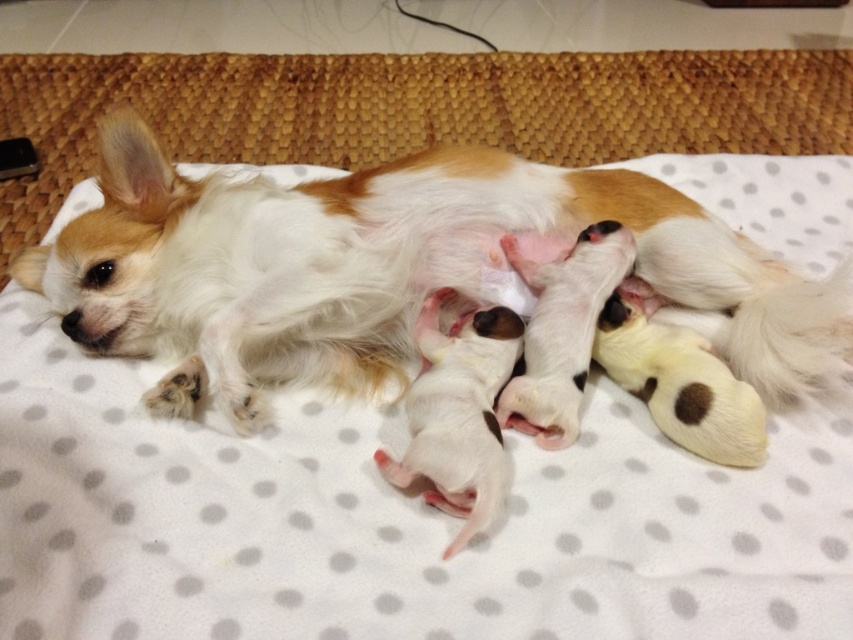
Question: Among these objects, which one is nearest to the camera?

Choices:
 (A) white fur dog at center
 (B) white soft puppies at center

Answer: (B)

Question: Is white fur dog at center positioned at the back of white soft puppies at center?

Choices:
 (A) no
 (B) yes

Answer: (B)

Question: From the image, what is the correct spatial relationship of white fur dog at center in relation to white soft puppies at center?

Choices:
 (A) below
 (B) above

Answer: (B)

Question: Which of the following is the farthest from the observer?

Choices:
 (A) (328, 353)
 (B) (482, 356)

Answer: (A)

Question: Does white fur dog at center appear under white soft puppies at center?

Choices:
 (A) no
 (B) yes

Answer: (A)